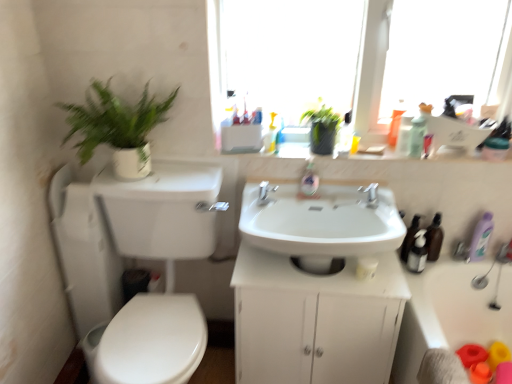
What do you see at coordinates (309, 181) in the screenshot?
I see `translucent plastic soap dispenser at center` at bounding box center [309, 181].

Measure the distance between point [381,233] and camera.

Point [381,233] and camera are 4.93 feet apart from each other.

This screenshot has height=384, width=512. What do you see at coordinates (117, 127) in the screenshot?
I see `green matte plant at left` at bounding box center [117, 127].

The image size is (512, 384). What do you see at coordinates (450, 317) in the screenshot?
I see `white plastic bathtub at lower right` at bounding box center [450, 317].

At what (x,y) coordinates should I click in order to perform the action: click on white plastic bathtub at lower right. Please return your answer as a coordinate pair (x, y). The image size is (512, 384). Looking at the image, I should click on (450, 317).

Where is `satin black soap dispenser at right, the 3th toiletry positioned from the right`? The image size is (512, 384). satin black soap dispenser at right, the 3th toiletry positioned from the right is located at coordinates (417, 253).

Where is `translucent plastic bottle at upper right, positioned as the fourth toiletry in right-to-left order`? Image resolution: width=512 pixels, height=384 pixels. translucent plastic bottle at upper right, positioned as the fourth toiletry in right-to-left order is located at coordinates (404, 136).

Describe the element at coordinates (404, 136) in the screenshot. The image size is (512, 384). I see `translucent plastic bottle at upper right, positioned as the fourth toiletry in right-to-left order` at that location.

Where is `satin black soap dispenser at right, acting as the 2th toiletry starting from the right`? This screenshot has width=512, height=384. satin black soap dispenser at right, acting as the 2th toiletry starting from the right is located at coordinates (410, 238).

Is satin black soap dispenser at right, the 3th toiletry positioned from the right, facing away from transparent glass window at upper center?

That's not correct — satin black soap dispenser at right, the 3th toiletry positioned from the right, is not looking away from transparent glass window at upper center.

Would you say transparent glass window at upper center is part of satin black soap dispenser at right, the fourth toiletry from the left,'s contents?

No, transparent glass window at upper center is located outside of satin black soap dispenser at right, the fourth toiletry from the left.

Based on the photo, from a real-world perspective, is satin black soap dispenser at right, the fourth toiletry from the left, on top of transparent glass window at upper center?

No.

From the image's perspective, is translucent plastic soap dispenser at center located above or below silver metallic faucet at center, which ranks as the second tap in right-to-left order?

From the image's perspective, translucent plastic soap dispenser at center appears above silver metallic faucet at center, which ranks as the second tap in right-to-left order.

Is translucent plastic soap dispenser at center wider or thinner than silver metallic faucet at center, which ranks as the second tap in right-to-left order?

→ Considering their sizes, translucent plastic soap dispenser at center looks slimmer than silver metallic faucet at center, which ranks as the second tap in right-to-left order.

From a real-world perspective, does translucent plastic soap dispenser at center sit lower than silver metallic faucet at center, which ranks as the second tap in right-to-left order?

No, from a real-world perspective, translucent plastic soap dispenser at center is not under silver metallic faucet at center, which ranks as the second tap in right-to-left order.

Is translucent plastic soap dispenser at center shorter than silver metallic faucet at center, marked as the 1th tap in a left-to-right arrangement?

In fact, translucent plastic soap dispenser at center may be taller than silver metallic faucet at center, marked as the 1th tap in a left-to-right arrangement.

Considering the positions of points (481, 227) and (403, 122), is point (481, 227) farther from camera compared to point (403, 122)?

Yes, it is.

Is purple glossy shampoo at right, positioned as the first toiletry in right-to-left order, next to translucent plastic bottle at upper right, positioned as the third toiletry in left-to-right order?

purple glossy shampoo at right, positioned as the first toiletry in right-to-left order, is not next to translucent plastic bottle at upper right, positioned as the third toiletry in left-to-right order, and they're not touching.

From the image's perspective, is purple glossy shampoo at right, marked as the sixth toiletry in a left-to-right arrangement, beneath translucent plastic bottle at upper right, positioned as the third toiletry in left-to-right order?

Yes, from the image's perspective, purple glossy shampoo at right, marked as the sixth toiletry in a left-to-right arrangement, is beneath translucent plastic bottle at upper right, positioned as the third toiletry in left-to-right order.

Which object is further away from the camera taking this photo, silver metallic faucet at center, positioned as the second tap in left-to-right order, or translucent orange soap dispenser at upper right, which is counted as the second toiletry, starting from the left?

translucent orange soap dispenser at upper right, which is counted as the second toiletry, starting from the left, is more distant.

How many degrees apart are the facing directions of silver metallic faucet at center, positioned as the second tap in left-to-right order, and translucent orange soap dispenser at upper right, which is counted as the second toiletry, starting from the left?

There is a 0.475-degree angle between the facing directions of silver metallic faucet at center, positioned as the second tap in left-to-right order, and translucent orange soap dispenser at upper right, which is counted as the second toiletry, starting from the left.

Looking at this image, from a real-world perspective, does silver metallic faucet at center, positioned as the second tap in left-to-right order, stand above translucent orange soap dispenser at upper right, the fifth toiletry in the right-to-left sequence?

Incorrect, from a real-world perspective, silver metallic faucet at center, positioned as the second tap in left-to-right order, is lower than translucent orange soap dispenser at upper right, the fifth toiletry in the right-to-left sequence.

Is point (372, 193) closer or farther from the camera than point (389, 141)?

Point (372, 193) is closer to the camera than point (389, 141).

Is green matte plant at left bigger than satin black soap dispenser at right, the fourth toiletry from the left?

Correct, green matte plant at left is larger in size than satin black soap dispenser at right, the fourth toiletry from the left.

From the picture: Does green matte plant at left appear on the left side of satin black soap dispenser at right, the 3th toiletry positioned from the right?

Indeed, green matte plant at left is positioned on the left side of satin black soap dispenser at right, the 3th toiletry positioned from the right.

From a real-world perspective, is green matte plant at left positioned above or below satin black soap dispenser at right, the 3th toiletry positioned from the right?

Clearly, from a real-world perspective, green matte plant at left is above satin black soap dispenser at right, the 3th toiletry positioned from the right.

Is point (395, 142) in front of point (412, 231)?

That is True.

Find the location of a particular element. Image resolution: width=512 pixels, height=384 pixels. the 2nd toiletry behind when counting from the satin black soap dispenser at right, acting as the 2th toiletry starting from the right is located at coordinates (395, 124).

Looking at their sizes, would you say translucent orange soap dispenser at upper right, the fifth toiletry in the right-to-left sequence, is wider or thinner than satin black soap dispenser at right, positioned as the 5th toiletry in left-to-right order?

Clearly, translucent orange soap dispenser at upper right, the fifth toiletry in the right-to-left sequence, has less width compared to satin black soap dispenser at right, positioned as the 5th toiletry in left-to-right order.

In terms of width, does green matte plant at left look wider or thinner when compared to translucent plastic soap dispenser at center?

Clearly, green matte plant at left has more width compared to translucent plastic soap dispenser at center.

From a real-world perspective, is green matte plant at left on top of translucent plastic soap dispenser at center?

Correct, in the physical world, green matte plant at left is higher than translucent plastic soap dispenser at center.

At what (x,y) coordinates should I click in order to perform the action: click on houseplant above the translucent plastic soap dispenser at center (from a real-world perspective). Please return your answer as a coordinate pair (x, y). Looking at the image, I should click on (117, 127).

Where is `the 3rd toiletry to the right of the transparent glass window at upper center, counting from the anchor's position`? This screenshot has width=512, height=384. the 3rd toiletry to the right of the transparent glass window at upper center, counting from the anchor's position is located at coordinates (417, 253).

In the image, there is a silver metallic faucet at center, marked as the 1th tap in a left-to-right arrangement. Identify the location of soap dispenser above it (from the image's perspective). The height and width of the screenshot is (384, 512). (309, 181).

Which object lies nearer to the anchor point translucent orange soap dispenser at upper right, which is counted as the second toiletry, starting from the left, translucent plastic soap dispenser at center or satin black soap dispenser at right, the 3th toiletry positioned from the right?

translucent plastic soap dispenser at center is closer to translucent orange soap dispenser at upper right, which is counted as the second toiletry, starting from the left.

From the picture: Estimate the real-world distances between objects in this image. Which object is closer to translucent plastic bottles at upper center, translucent plastic bottle at upper right, positioned as the fourth toiletry in right-to-left order, or satin black soap dispenser at right, the 3th toiletry positioned from the right?

The object closer to translucent plastic bottles at upper center is translucent plastic bottle at upper right, positioned as the fourth toiletry in right-to-left order.

Looking at the image, which one is located closer to green matte plant at left, white glossy sink at center or silver metallic faucet at center, positioned as the second tap in left-to-right order?

white glossy sink at center is positioned closer to the anchor green matte plant at left.

Looking at the image, which one is located closer to white glossy sink at center, satin black soap dispenser at right, the 3th toiletry positioned from the right, or silver metallic faucet at center, which ranks as the second tap in right-to-left order?

silver metallic faucet at center, which ranks as the second tap in right-to-left order, is closer to white glossy sink at center.

Considering their positions, is transparent glass window at upper center positioned further to purple glossy shampoo at right, positioned as the first toiletry in right-to-left order, than satin black soap dispenser at right, positioned as the 5th toiletry in left-to-right order?

transparent glass window at upper center is further to purple glossy shampoo at right, positioned as the first toiletry in right-to-left order.

When comparing their distances from satin black soap dispenser at right, positioned as the 5th toiletry in left-to-right order, does satin black soap dispenser at right, the fourth toiletry from the left, or translucent plastic soap dispenser at center seem closer?

The object closer to satin black soap dispenser at right, positioned as the 5th toiletry in left-to-right order, is satin black soap dispenser at right, the fourth toiletry from the left.

Which object lies nearer to the anchor point purple glossy shampoo at right, marked as the sixth toiletry in a left-to-right arrangement, transparent glass window at upper center or silver metallic faucet at center, positioned as the second tap in left-to-right order?

Among the two, silver metallic faucet at center, positioned as the second tap in left-to-right order, is located nearer to purple glossy shampoo at right, marked as the sixth toiletry in a left-to-right arrangement.

Which object lies further to the anchor point green matte plant at upper center, green matte plant at left or silver metallic faucet at center, which ranks as the second tap in right-to-left order?

Based on the image, green matte plant at left appears to be further to green matte plant at upper center.

Locate an element on the screen. The width and height of the screenshot is (512, 384). sink that lies between silver metallic faucet at center, which ranks as the second tap in right-to-left order, and white matte cabinet at center from top to bottom is located at coordinates (321, 224).

Identify the location of window sill between silver metallic faucet at center, which ranks as the second tap in right-to-left order, and purple glossy shampoo at right, positioned as the first toiletry in right-to-left order, from left to right. (282, 151).

Locate an element on the screen. sink between translucent orange soap dispenser at upper right, the fifth toiletry in the right-to-left sequence, and white plastic bathtub at lower right, in the vertical direction is located at coordinates (321, 224).

Identify the location of tap situated between white matte cabinet at center and purple glossy shampoo at right, marked as the sixth toiletry in a left-to-right arrangement, from left to right. The height and width of the screenshot is (384, 512). (371, 195).